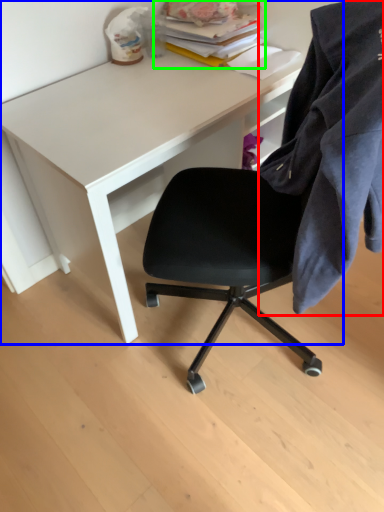
Question: Which is nearer to the cloth (highlighted by a red box)? desk (highlighted by a blue box) or book (highlighted by a green box).

Choices:
 (A) desk
 (B) book

Answer: (A)